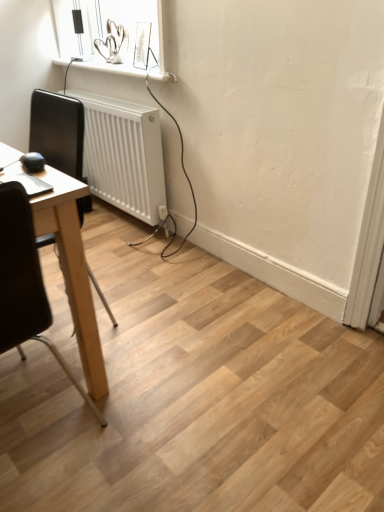
Question: Is black leather chair at left, positioned as the first chair in front-to-back order, wider or thinner than white plastic radiator at lower left?

Choices:
 (A) wide
 (B) thin

Answer: (A)

Question: Is black leather chair at left, positioned as the first chair in front-to-back order, inside or outside of white plastic radiator at lower left?

Choices:
 (A) outside
 (B) inside

Answer: (A)

Question: Which object is the farthest from the white plastic radiator at lower left?

Choices:
 (A) black leather chair at left, the second chair positioned from the back
 (B) black leather chair at left, positioned as the second chair in front-to-back order

Answer: (A)

Question: Considering the real-world distances, which object is closest to the white plastic radiator at lower left?

Choices:
 (A) black leather chair at left, the second chair positioned from the back
 (B) black leather chair at left, positioned as the second chair in front-to-back order

Answer: (B)